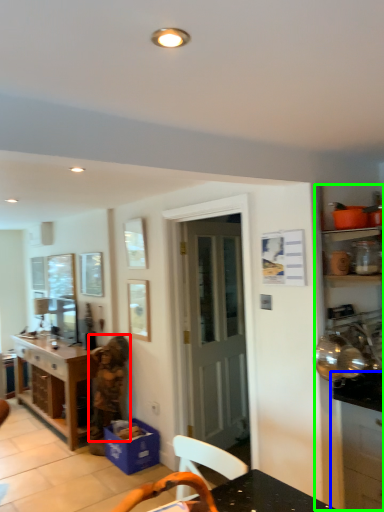
Question: Estimate the real-world distances between objects in this image. Which object is closer to person (highlighted by a red box), cabinetry (highlighted by a blue box) or dresser (highlighted by a green box)?

Choices:
 (A) cabinetry
 (B) dresser

Answer: (B)